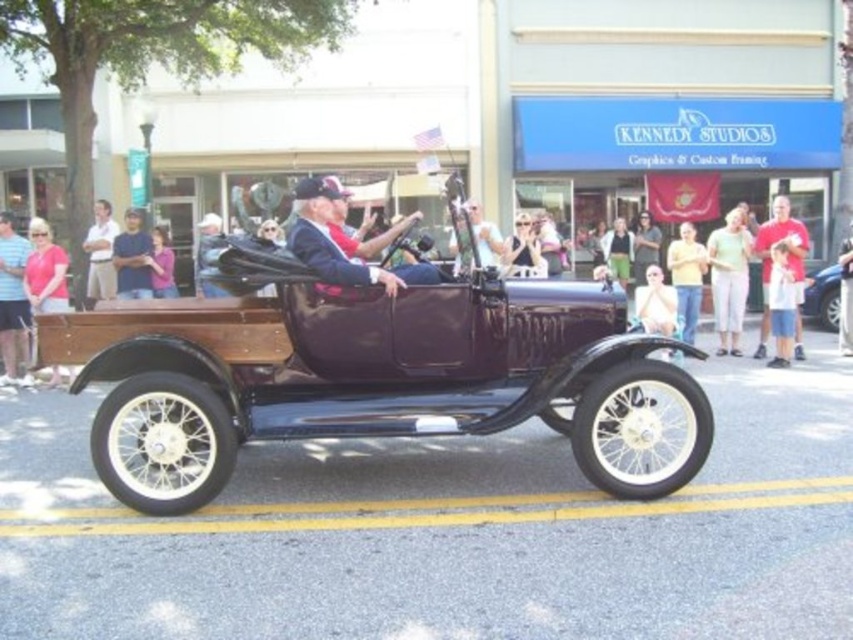
Question: Observing the image, what is the correct spatial positioning of shiny dark purple convertible at center in reference to yellow matte shirt at center?

Choices:
 (A) right
 (B) left

Answer: (B)

Question: Does light brown leather jacket at left appear under shiny blue car at center?

Choices:
 (A) no
 (B) yes

Answer: (A)

Question: Can you confirm if light blue shirt at left is positioned above light brown leather jacket at left?

Choices:
 (A) yes
 (B) no

Answer: (B)

Question: Which of the following is the farthest from the observer?

Choices:
 (A) matte blue shirt at left
 (B) shiny blue car at center
 (C) shiny dark purple convertible at center
 (D) matte pink shirt at left

Answer: (B)

Question: Which point is closer to the camera?

Choices:
 (A) (782, 294)
 (B) (834, 300)
 (C) (338, 280)

Answer: (C)

Question: Which object is the farthest from the shiny dark purple convertible at center?

Choices:
 (A) matte black camera at center
 (B) matte blue shirt at left

Answer: (B)